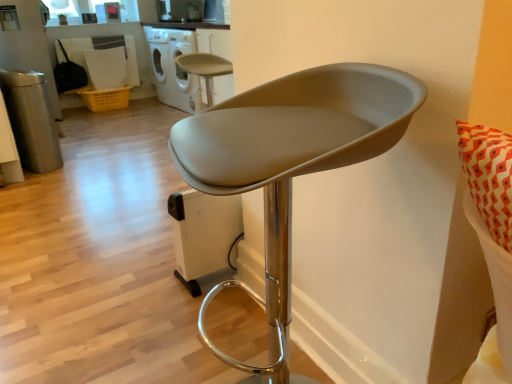
Question: In terms of height, does matte gray stool at center, which is counted as the 2th chair, starting from the bottom, look taller or shorter compared to matte gray stool at center, the 1th chair when ordered from bottom to top?

Choices:
 (A) tall
 (B) short

Answer: (B)

Question: Is matte gray stool at center, which is the 1th chair in top-to-bottom order, wider or thinner than matte gray stool at center, which is the 2th chair in left-to-right order?

Choices:
 (A) wide
 (B) thin

Answer: (A)

Question: Which object is the closest to the matte gray stool at center, which is the 2th chair from top to bottom?

Choices:
 (A) matte gray stool at center, which is the 1th chair in top-to-bottom order
 (B) white glossy dishwasher at upper center

Answer: (A)

Question: Which of these objects is positioned farthest from the white glossy dishwasher at upper center?

Choices:
 (A) matte gray stool at center, which is counted as the 2th chair, starting from the bottom
 (B) matte gray stool at center, which is the 2th chair in left-to-right order

Answer: (B)